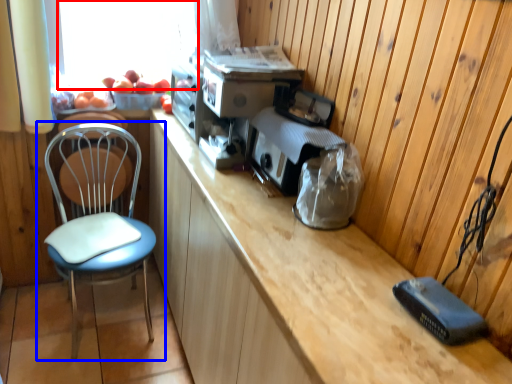
Question: Among these objects, which one is farthest to the camera, window screen (highlighted by a red box) or chair (highlighted by a blue box)?

Choices:
 (A) window screen
 (B) chair

Answer: (A)